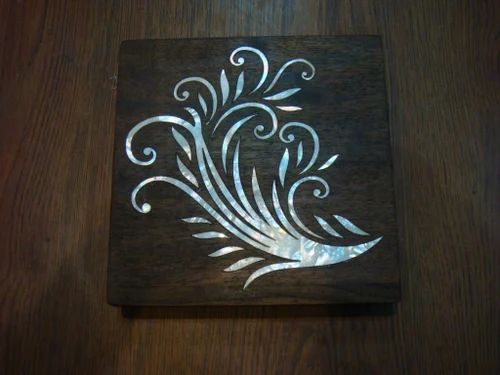
You are a GUI agent. You are given a task and a screenshot of the screen. Output one action in this format:
    pyautogui.click(x=<x>, y=<y>)
    Task: Click on the brown wooden tabletop
    Image resolution: width=500 pixels, height=375 pixels.
    Given the screenshot: What is the action you would take?
    pyautogui.click(x=470, y=138), pyautogui.click(x=51, y=170)